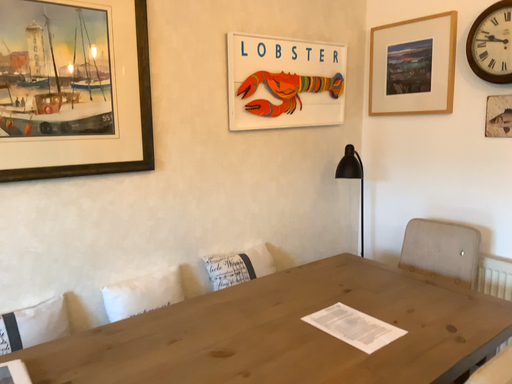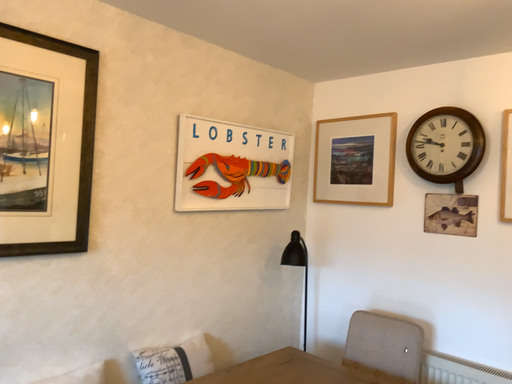
Question: Which way did the camera rotate in the video?

Choices:
 (A) rotated left
 (B) rotated right

Answer: (B)